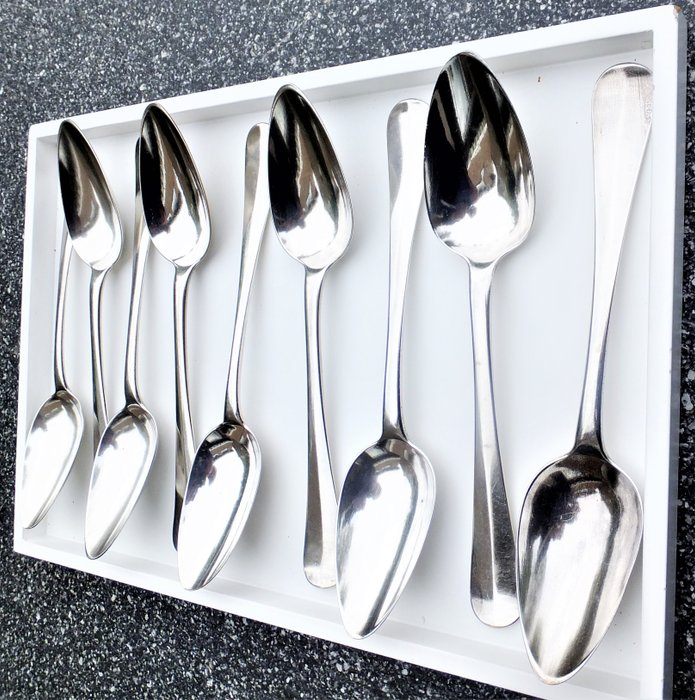
Where is `silverware on a serving tray`? The image size is (695, 700). silverware on a serving tray is located at coordinates (586, 512), (477, 150), (397, 519), (320, 180), (224, 477), (176, 172), (121, 472), (95, 200), (44, 479), (274, 363).